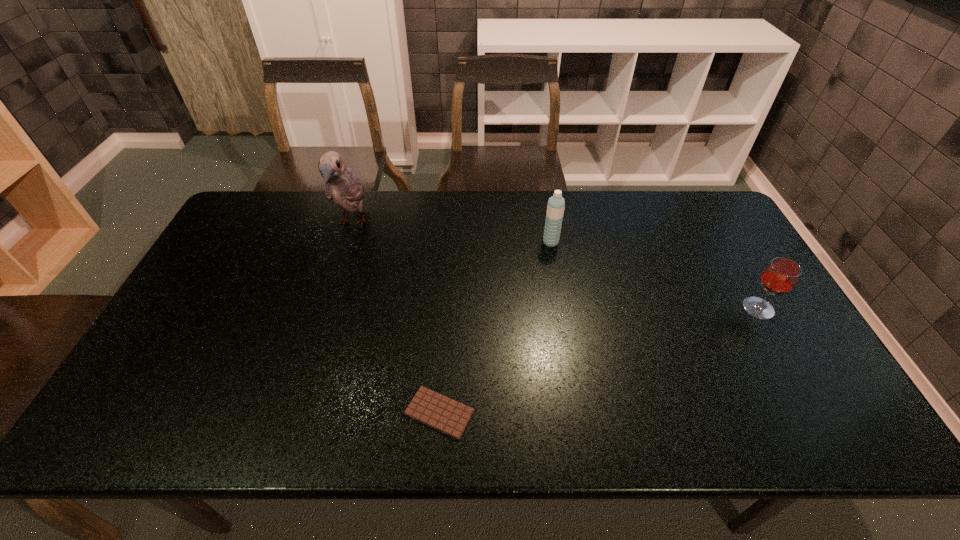
Find the location of `vacant space positioned on the left of the second shortest object`. vacant space positioned on the left of the second shortest object is located at coordinates (636, 308).

At what (x,y) coordinates should I click in order to perform the action: click on free point located on the back of the nearest object. Please return your answer as a coordinate pair (x, y). Image resolution: width=960 pixels, height=540 pixels. Looking at the image, I should click on (444, 355).

I want to click on object that is at the far edge, so click(342, 185).

Locate an element on the screen. object at the near edge is located at coordinates click(442, 413).

Where is `object that is at the right edge`? The image size is (960, 540). object that is at the right edge is located at coordinates (781, 275).

Locate an element on the screen. This screenshot has height=540, width=960. free location at the far edge is located at coordinates (471, 215).

This screenshot has height=540, width=960. Identify the location of vacant space at the right edge. (826, 378).

In the image, there is a desktop. Identify the location of vacant space at the far left corner. The image size is (960, 540). (244, 204).

Locate an element on the screen. The image size is (960, 540). free region at the near right corner of the desktop is located at coordinates (848, 417).

Find the location of a particular element. This screenshot has width=960, height=540. free area in between the tallest object and the chocolate bar is located at coordinates (396, 318).